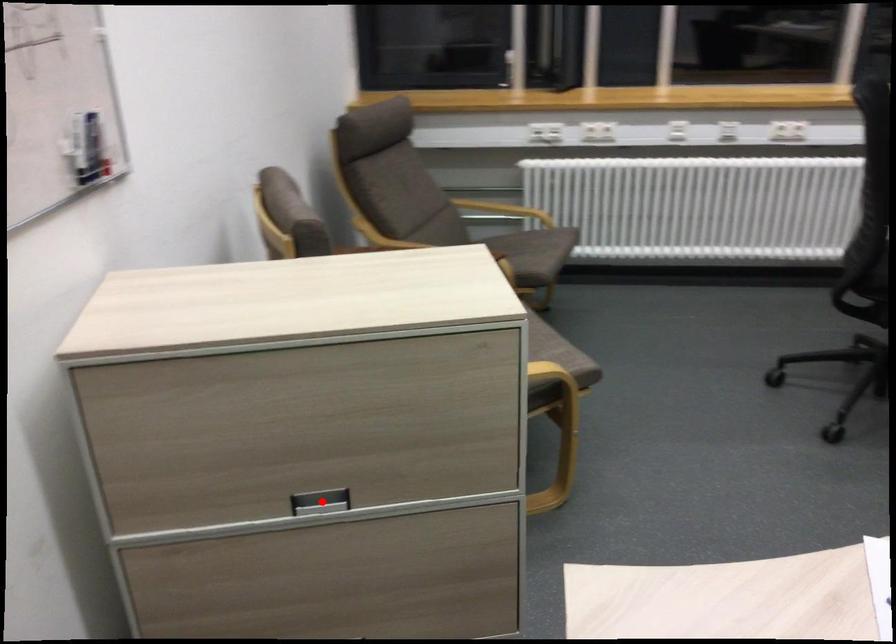
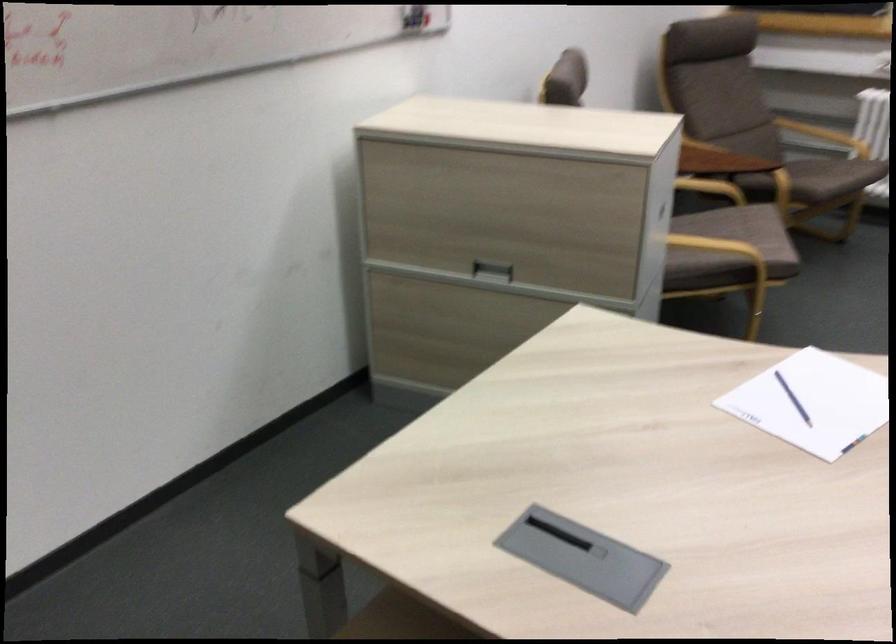
Find the pixel in the second image that matches the highlighted location in the first image.

(492, 270)